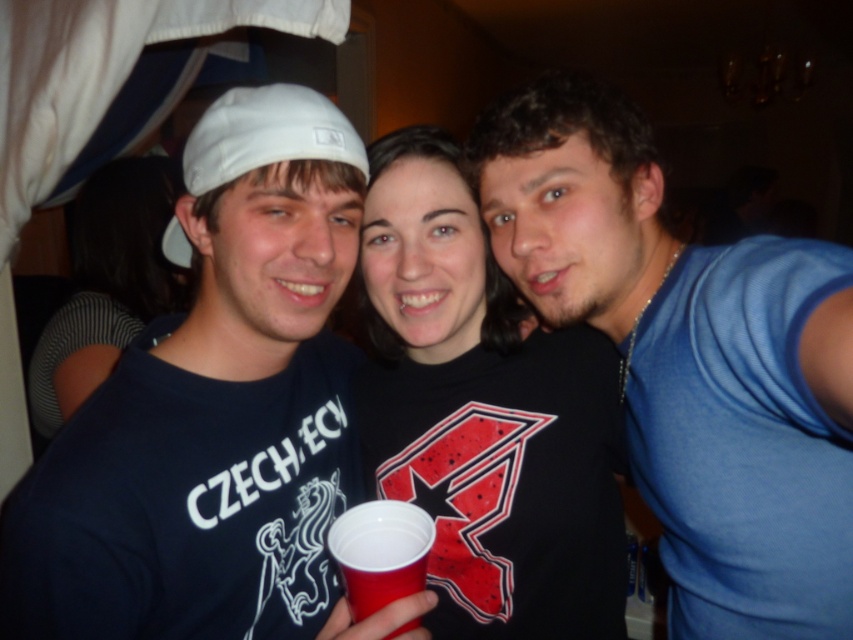
Consider the image. Does striped fabric shirt at center appear on the right side of red plastic cup at center?

No, striped fabric shirt at center is not to the right of red plastic cup at center.

Is point (152, 209) more distant than point (374, 588)?

Yes, point (152, 209) is farther from viewer.

Is point (161, 305) behind point (386, 524)?

Yes, point (161, 305) is farther from viewer.

You are a GUI agent. You are given a task and a screenshot of the screen. Output one action in this format:
    pyautogui.click(x=<x>, y=<y>)
    Task: Click on the striped fabric shirt at center
    The height and width of the screenshot is (640, 853).
    Given the screenshot: What is the action you would take?
    pyautogui.click(x=108, y=284)

Is matte white cap at center positioned at the back of striped fabric shirt at center?

No, it is in front of striped fabric shirt at center.

Does point (97, 534) come in front of point (74, 328)?

Yes.

Which is behind, point (1, 531) or point (76, 218)?

Positioned behind is point (76, 218).

Image resolution: width=853 pixels, height=640 pixels. I want to click on matte white cap at center, so click(x=216, y=412).

Is point (569, 264) in front of point (112, 310)?

Yes, point (569, 264) is in front of point (112, 310).

Consider the image. Can you confirm if blue mesh tank top at right is positioned to the left of striped fabric shirt at center?

No, blue mesh tank top at right is not to the left of striped fabric shirt at center.

Is point (758, 426) positioned before point (152, 212)?

Yes, point (758, 426) is in front of point (152, 212).

Locate an element on the screen. The image size is (853, 640). blue mesh tank top at right is located at coordinates (689, 358).